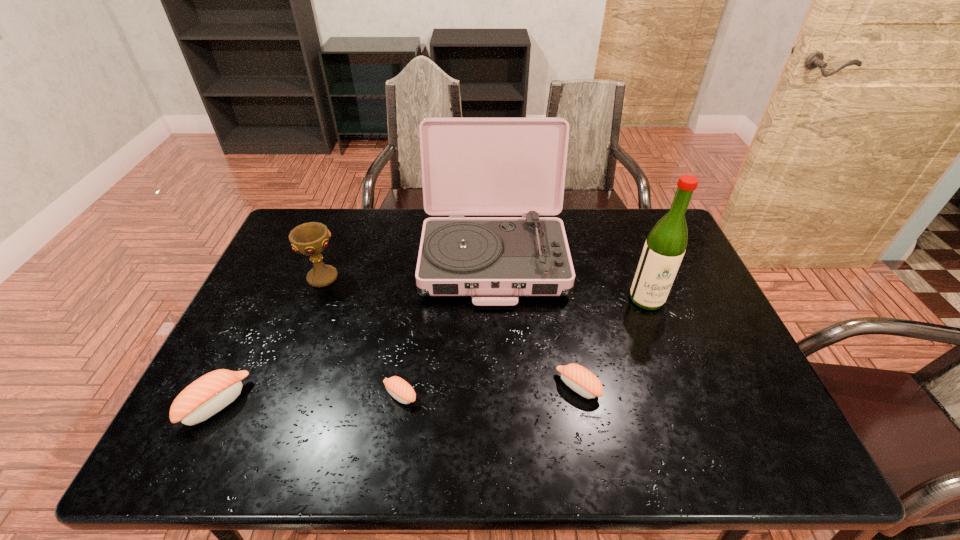
You are a GUI agent. You are given a task and a screenshot of the screen. Output one action in this format:
    pyautogui.click(x=<x>, y=<y>)
    Task: Click on the vacant area located 0.120m on the right of the leftmost sushi
    The width and height of the screenshot is (960, 540).
    Given the screenshot: What is the action you would take?
    pyautogui.click(x=295, y=403)

At what (x,y) coordinates should I click in order to perform the action: click on vacant region located on the back of the shortest sushi. Please return your answer as a coordinate pair (x, y). The image size is (960, 540). Looking at the image, I should click on (404, 365).

Find the location of `free location located 0.120m on the left of the second tallest sushi`. free location located 0.120m on the left of the second tallest sushi is located at coordinates [x=507, y=387].

Locate an element on the screen. The image size is (960, 540). free space located with the lid open on the record player is located at coordinates (498, 397).

The height and width of the screenshot is (540, 960). I want to click on vacant space positioned on the back of the chalice, so click(330, 255).

Locate an element on the screen. blank area located on the label of the liquor is located at coordinates (660, 334).

You are a GUI agent. You are given a task and a screenshot of the screen. Output one action in this format:
    pyautogui.click(x=<x>, y=<y>)
    Task: Click on the object that is at the far edge
    
    Given the screenshot: What is the action you would take?
    pyautogui.click(x=470, y=166)

Locate an element on the screen. This screenshot has width=960, height=540. sushi present at the left edge is located at coordinates (206, 396).

Find the location of a particular element. Image resolution: width=960 pixels, height=540 pixels. chalice positioned at the left edge is located at coordinates (310, 239).

The image size is (960, 540). In order to click on object at the right edge in this screenshot , I will do `click(666, 243)`.